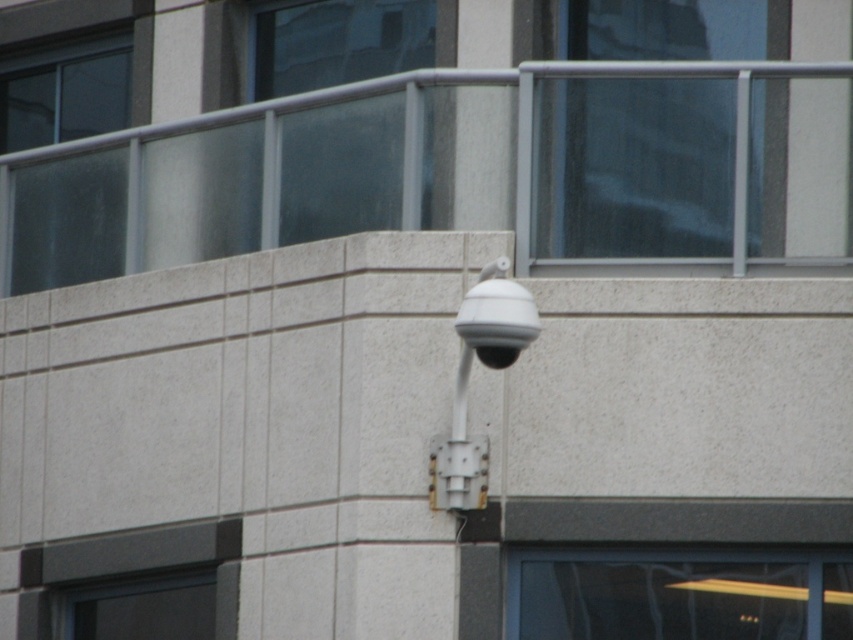
How distant is transparent glass window at upper left from transparent glass at upper center?

The distance of transparent glass window at upper left from transparent glass at upper center is 1.69 meters.

This screenshot has width=853, height=640. I want to click on transparent glass window at upper left, so click(x=67, y=221).

At what (x,y) coordinates should I click in order to perform the action: click on transparent glass window at upper left. Please return your answer as a coordinate pair (x, y). Image resolution: width=853 pixels, height=640 pixels. Looking at the image, I should click on (67, 221).

Is point (779, 552) positioned in front of point (180, 545)?

Yes, point (779, 552) is closer to viewer.

Can you confirm if transparent glass window at lower right is positioned below dark gray concrete window at lower left?

No.

This screenshot has width=853, height=640. What do you see at coordinates (677, 593) in the screenshot?
I see `transparent glass window at lower right` at bounding box center [677, 593].

Locate an element on the screen. transparent glass window at lower right is located at coordinates (677, 593).

Can you confirm if transparent glass at upper center is positioned above dark gray concrete window at lower left?

Indeed, transparent glass at upper center is positioned over dark gray concrete window at lower left.

Find the location of `transparent glass at upper center`. transparent glass at upper center is located at coordinates (343, 42).

Where is `transparent glass at upper center`? transparent glass at upper center is located at coordinates (343, 42).